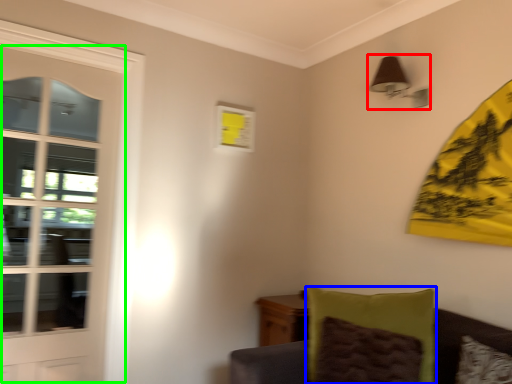
Question: Which object is positioned farthest from light fixture (highlighted by a red box)? Select from pillow (highlighted by a blue box) and door (highlighted by a green box).

Choices:
 (A) pillow
 (B) door

Answer: (B)